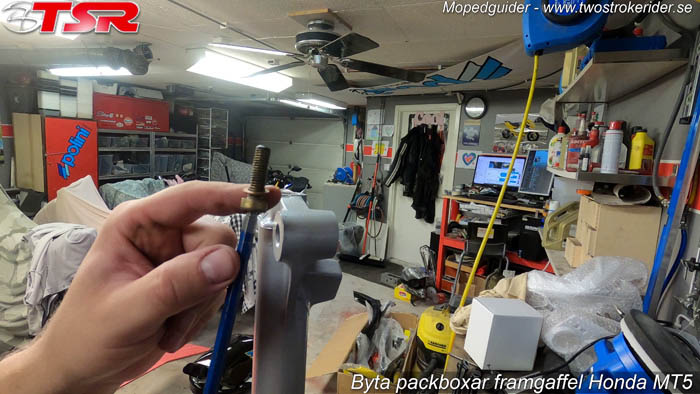
Locate an element on the screen. The width and height of the screenshot is (700, 394). computer monitors is located at coordinates (495, 164), (539, 169).